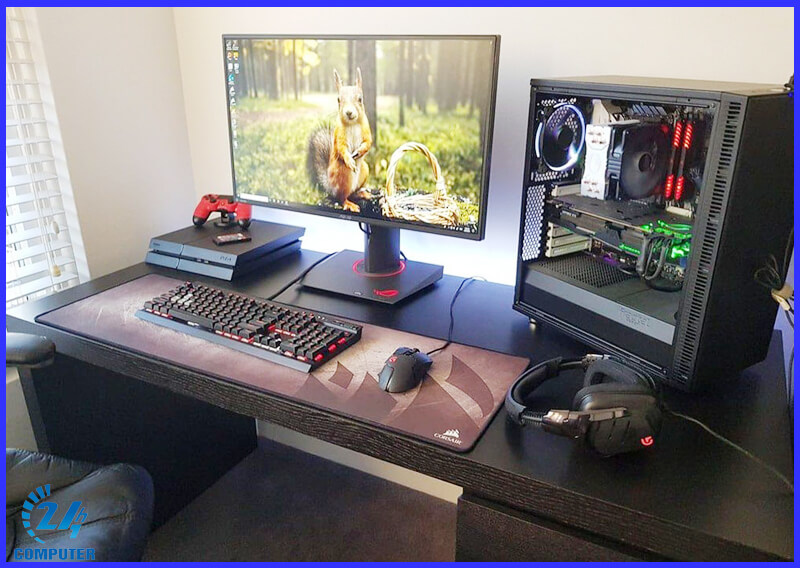
Locate an element on the screen. mouse is located at coordinates (410, 363).